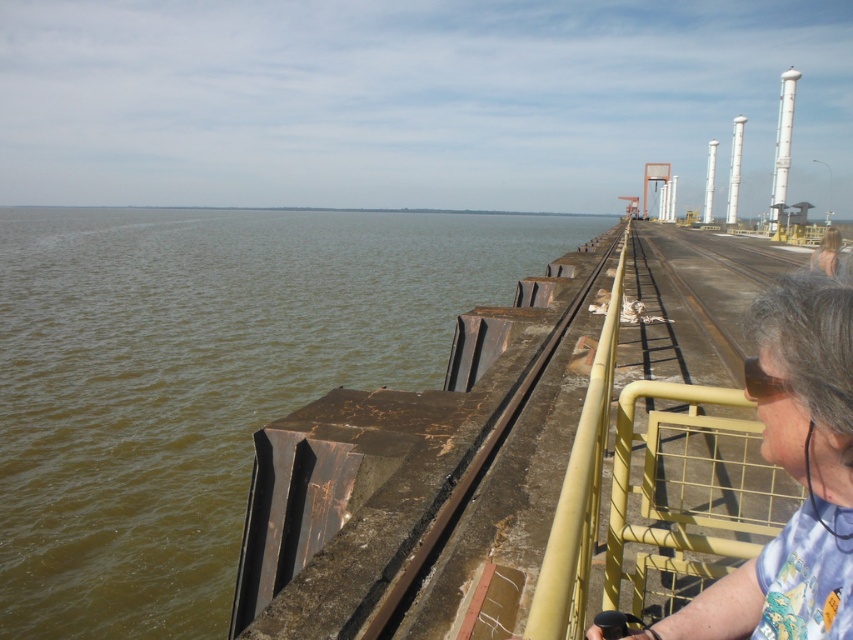
Is brown water at center taller than yellow metal rail at center?

Correct, brown water at center is much taller as yellow metal rail at center.

Does brown water at center appear on the left side of yellow metal rail at center?

Correct, you'll find brown water at center to the left of yellow metal rail at center.

Is point (225, 291) farther from camera compared to point (444, 522)?

Yes.

Where is `brown water at center`? Image resolution: width=853 pixels, height=640 pixels. brown water at center is located at coordinates (198, 381).

Is brown water at center closer to the viewer compared to gray hair at right?

No, it is not.

Between point (173, 360) and point (836, 316), which one is positioned in front?

Point (836, 316)

Between point (294, 236) and point (840, 600), which one is positioned in front?

Point (840, 600)

Locate an element on the screen. This screenshot has height=640, width=853. brown water at center is located at coordinates (198, 381).

Is gray hair at right wider than yellow metal rail at center?

Incorrect, gray hair at right's width does not surpass yellow metal rail at center's.

Who is positioned more to the right, gray hair at right or yellow metal rail at center?

yellow metal rail at center

Does point (692, 609) come behind point (578, 300)?

No, (692, 609) is closer to viewer.

Where is `gray hair at right`? Image resolution: width=853 pixels, height=640 pixels. gray hair at right is located at coordinates (793, 474).